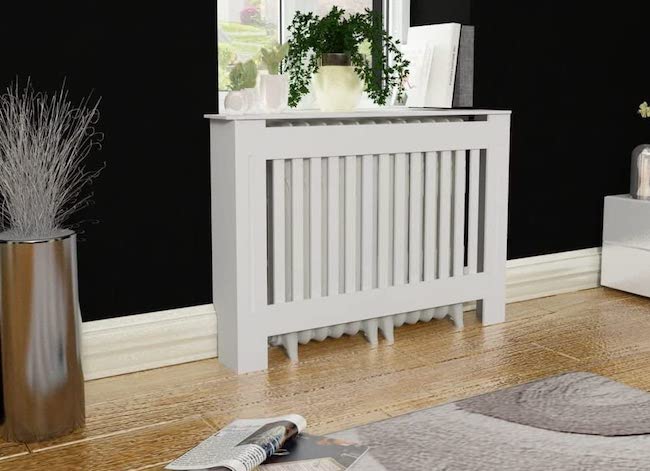
This screenshot has height=471, width=650. In order to click on wall in this screenshot , I will do `click(136, 139)`.